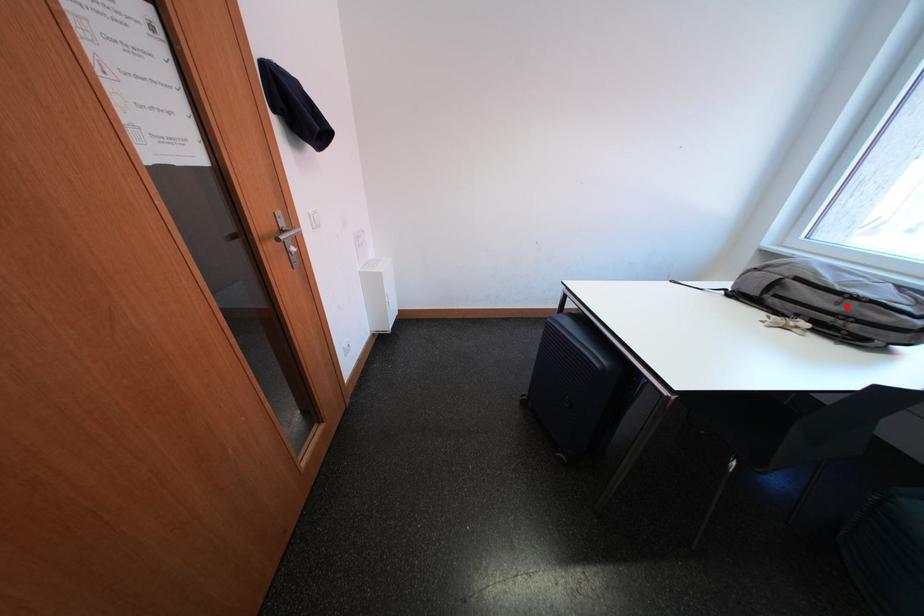
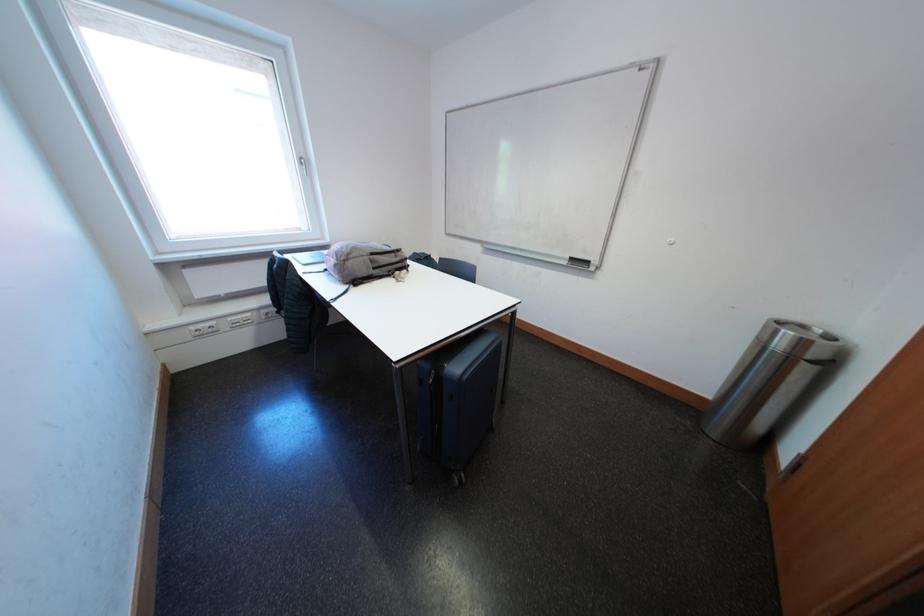
The point at the highlighted location is marked in the first image. Where is the corresponding point in the second image?

(406, 261)